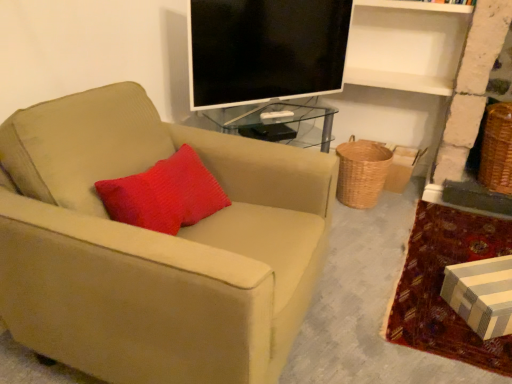
The image size is (512, 384). What are the coordinates of `vacant space to the right of suede beige armchair at left` in the screenshot? It's located at (365, 294).